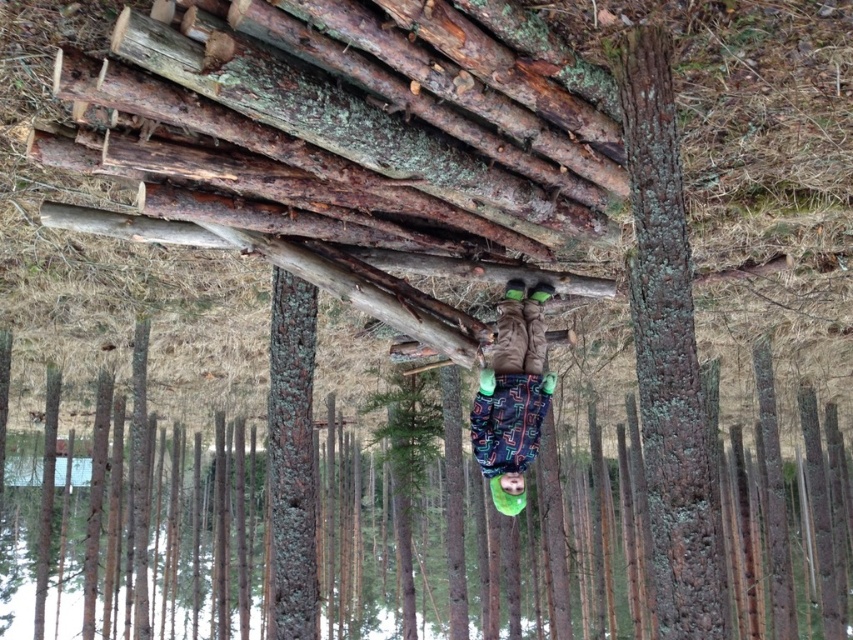
You are planning to place a new sign on the ground near the dark brown fabric snowboard at center and the green matte tree at center. Since you want the sign to be visible from above, where should you place it relative to these two objects?

The dark brown fabric snowboard at center is above the green matte tree at center, so placing the sign near the green matte tree at center would make it visible from above the snowboard.

Looking at this image, you are a hiker trying to find the tallest tree in the forest. You see a dark brown rough bark at center and a green matte tree at center. Which tree should you choose to climb for the best view?

The green matte tree at center is taller than the dark brown rough bark at center, so you should choose the green matte tree at center to climb for the best view.